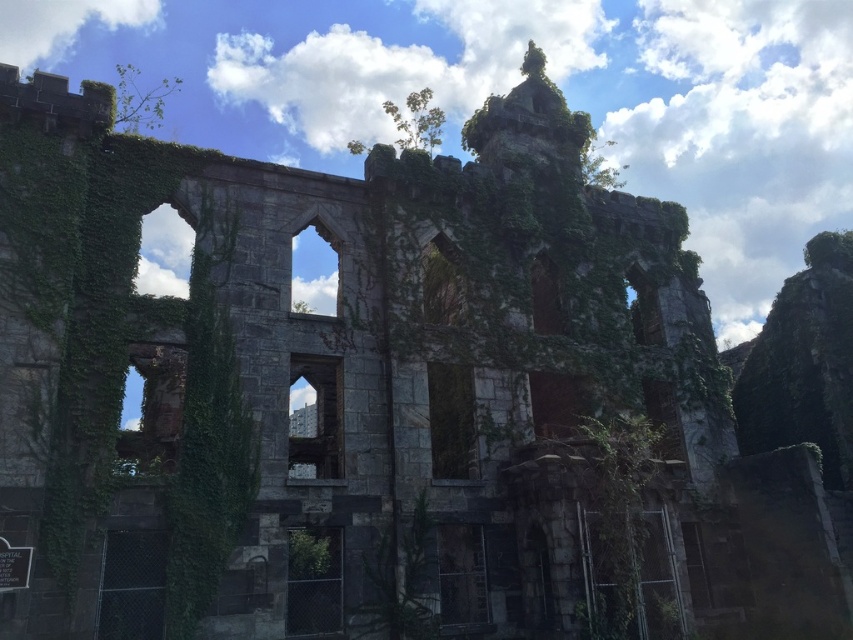
Between point (119, 76) and point (433, 125), which one is positioned in front?

Point (433, 125)

The width and height of the screenshot is (853, 640). What do you see at coordinates (140, 100) in the screenshot? I see `green leafy tree at upper left` at bounding box center [140, 100].

This screenshot has height=640, width=853. Identify the location of green leafy tree at upper left. (140, 100).